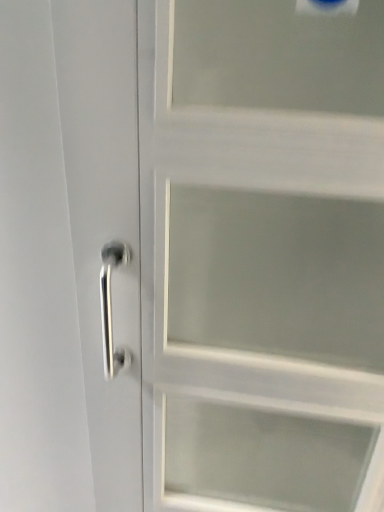
This screenshot has height=512, width=384. Describe the element at coordinates (264, 256) in the screenshot. I see `satin silver handle at center-left` at that location.

I want to click on satin silver handle at center-left, so click(x=264, y=256).

Locate an element on the screen. The width and height of the screenshot is (384, 512). satin silver handle at center-left is located at coordinates (264, 256).